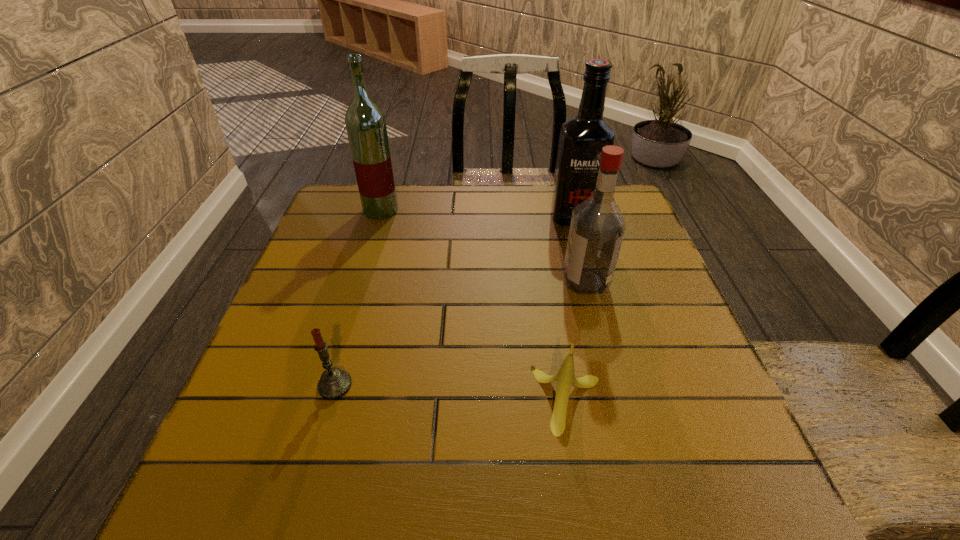
The width and height of the screenshot is (960, 540). In order to click on the leftmost liquor in this screenshot , I will do `click(365, 122)`.

Find the location of `the third shortest object`. the third shortest object is located at coordinates (597, 228).

The image size is (960, 540). In order to click on the shortest liquor in this screenshot , I will do `click(597, 228)`.

Identify the location of candle. (334, 383).

Where is `banana`? banana is located at coordinates (565, 377).

Locate an element on the screen. vacant space located 0.230m on the right of the leftmost liquor is located at coordinates (478, 211).

Where is `free space located on the front-facing side of the third tallest object`? The image size is (960, 540). free space located on the front-facing side of the third tallest object is located at coordinates (509, 281).

Locate an element on the screen. This screenshot has height=540, width=960. free region located 0.130m on the front-facing side of the third tallest object is located at coordinates (509, 281).

At what (x,y) coordinates should I click in order to perform the action: click on vacant space located 0.090m on the front-facing side of the third tallest object. Please return your answer as a coordinate pair (x, y). Looking at the image, I should click on (526, 281).

Where is `vacant space situated on the back of the candle`? The image size is (960, 540). vacant space situated on the back of the candle is located at coordinates (372, 254).